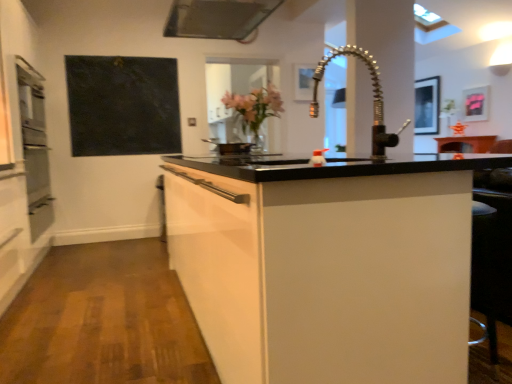
Question: Considering the relative sizes of metallic silver picture frame at upper right, which appears as the second picture frame when viewed from the left, and black matte board at upper left in the image provided, is metallic silver picture frame at upper right, which appears as the second picture frame when viewed from the left, thinner than black matte board at upper left?

Choices:
 (A) no
 (B) yes

Answer: (B)

Question: Does metallic silver picture frame at upper right, the first picture frame in the back-to-front sequence, appear on the left side of black matte board at upper left?

Choices:
 (A) yes
 (B) no

Answer: (B)

Question: Are metallic silver picture frame at upper right, which appears as the second picture frame when viewed from the left, and black matte board at upper left making contact?

Choices:
 (A) yes
 (B) no

Answer: (B)

Question: Considering the relative positions of metallic silver picture frame at upper right, which ranks as the 3th picture frame in front-to-back order, and black matte board at upper left in the image provided, is metallic silver picture frame at upper right, which ranks as the 3th picture frame in front-to-back order, in front of black matte board at upper left?

Choices:
 (A) no
 (B) yes

Answer: (A)

Question: From a real-world perspective, is metallic silver picture frame at upper right, placed as the second picture frame when sorted from right to left, located higher than black matte board at upper left?

Choices:
 (A) no
 (B) yes

Answer: (B)

Question: Does point (234, 147) appear closer or farther from the camera than point (417, 87)?

Choices:
 (A) farther
 (B) closer

Answer: (B)

Question: Which is correct: black matte pan at center is inside metallic silver picture frame at upper right, which ranks as the 3th picture frame in front-to-back order, or outside of it?

Choices:
 (A) outside
 (B) inside

Answer: (A)

Question: Relative to metallic silver picture frame at upper right, which appears as the second picture frame when viewed from the left, is black matte pan at center in front or behind?

Choices:
 (A) front
 (B) behind

Answer: (A)

Question: Considering the positions of black matte pan at center and metallic silver picture frame at upper right, the first picture frame in the back-to-front sequence, in the image, is black matte pan at center taller or shorter than metallic silver picture frame at upper right, the first picture frame in the back-to-front sequence,?

Choices:
 (A) tall
 (B) short

Answer: (B)

Question: Is white glossy cabinet at center taller or shorter than metallic silver exhaust hood at upper center?

Choices:
 (A) short
 (B) tall

Answer: (B)

Question: Is point (358, 307) closer or farther from the camera than point (233, 4)?

Choices:
 (A) farther
 (B) closer

Answer: (B)

Question: Relative to metallic silver exhaust hood at upper center, is white glossy cabinet at center in front or behind?

Choices:
 (A) front
 (B) behind

Answer: (A)

Question: Is white glossy cabinet at center inside the boundaries of metallic silver exhaust hood at upper center, or outside?

Choices:
 (A) outside
 (B) inside

Answer: (A)

Question: From the image's perspective, is white glossy cabinet at center located above or below black matte pan at center?

Choices:
 (A) above
 (B) below

Answer: (B)

Question: Visually, is white glossy cabinet at center positioned to the left or to the right of black matte pan at center?

Choices:
 (A) right
 (B) left

Answer: (A)